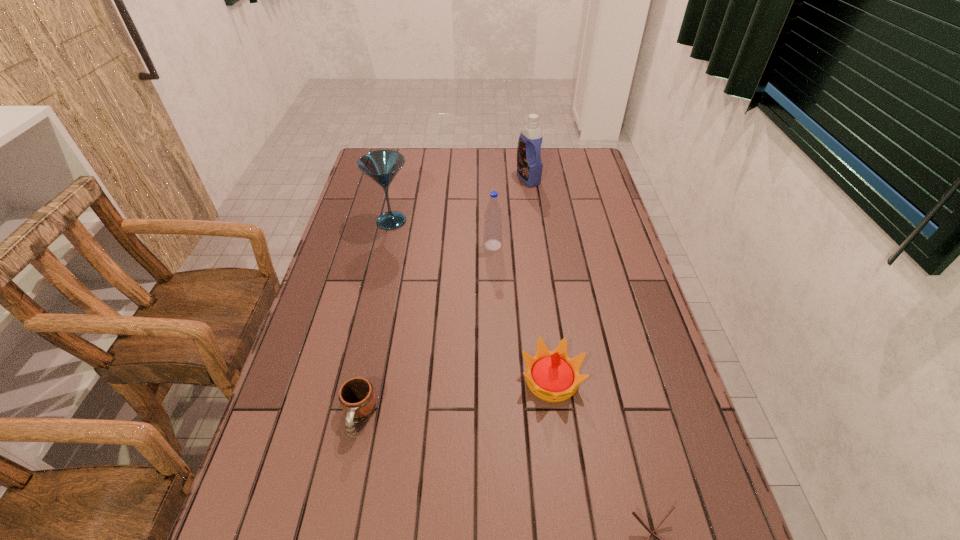
Where is `vacant space that's between the fourth tallest object and the second farthest object`? The image size is (960, 540). vacant space that's between the fourth tallest object and the second farthest object is located at coordinates (471, 301).

In order to click on vacant area that lies between the third shortest object and the second shortest object in this screenshot , I will do `click(455, 398)`.

Find the location of a particular element. vacant point located between the fourth tallest object and the mug is located at coordinates (455, 398).

You are a GUI agent. You are given a task and a screenshot of the screen. Output one action in this format:
    pyautogui.click(x=<x>, y=<y>)
    Task: Click on the free space between the water bottle and the fifth nearest object
    This screenshot has width=960, height=540.
    Given the screenshot: What is the action you would take?
    pyautogui.click(x=442, y=233)

I want to click on unoccupied area between the fifth nearest object and the second shortest object, so click(x=375, y=319).

What are the coordinates of `vacant space in between the second farthest object and the detergent` in the screenshot? It's located at (460, 200).

Select which object is the fifth closest to the farthest object. Please provide its 2D coordinates. Your answer should be formatted as a tuple, i.e. [(x, y)], where the tuple contains the x and y coordinates of a point satisfying the conditions above.

[(636, 516)]

Identify which object is located as the fourth nearest to the shortest object. Please provide its 2D coordinates. Your answer should be formatted as a tuple, i.e. [(x, y)], where the tuple contains the x and y coordinates of a point satisfying the conditions above.

[(382, 166)]

The height and width of the screenshot is (540, 960). I want to click on vacant space that satisfies the following two spatial constraints: 1. on the back side of the water bottle; 2. on the right side of the detergent, so click(x=491, y=178).